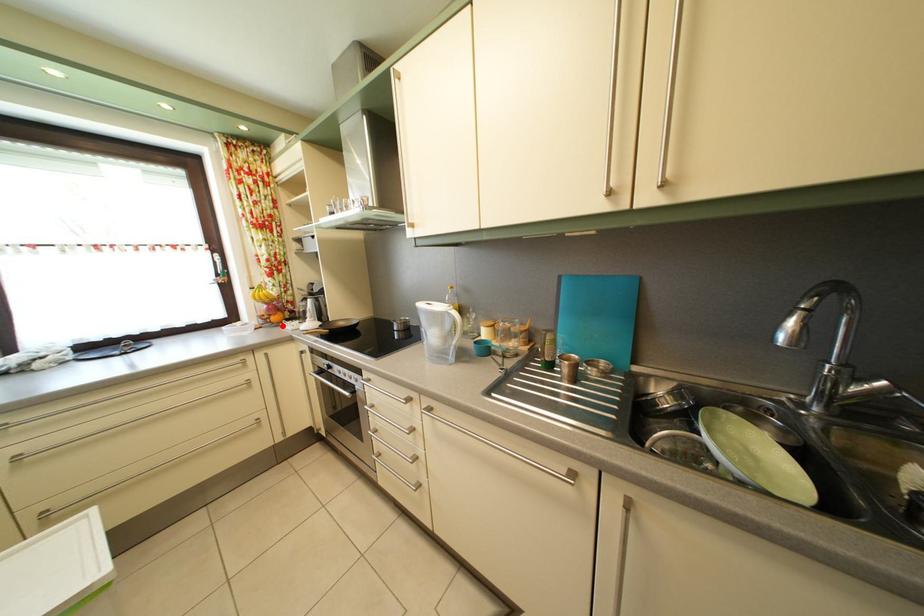
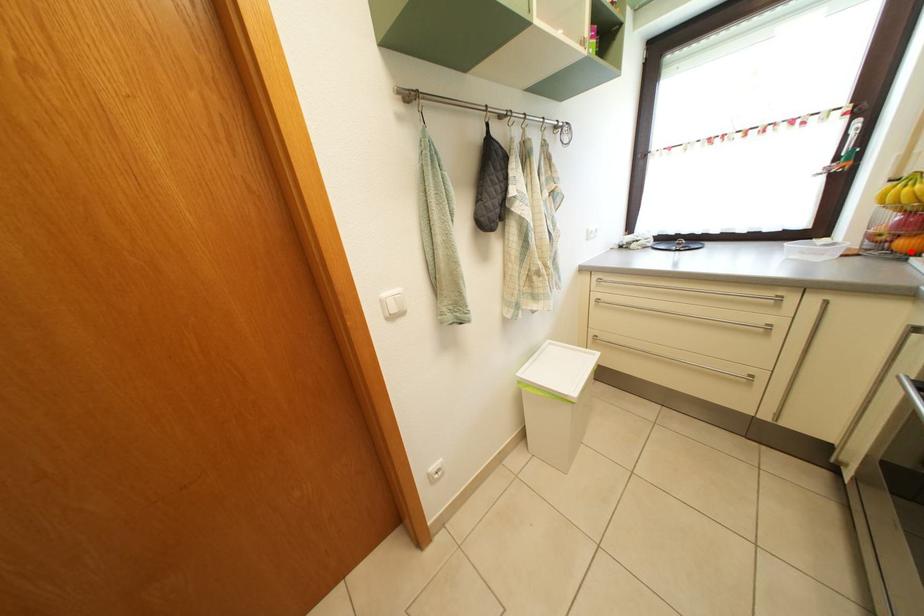
I am providing you with two images of the same scene from different viewpoints. A red point is marked on the first image and another point is marked on the second image. Do the highlighted points in image1 and image2 indicate the same real-world spot?

Yes